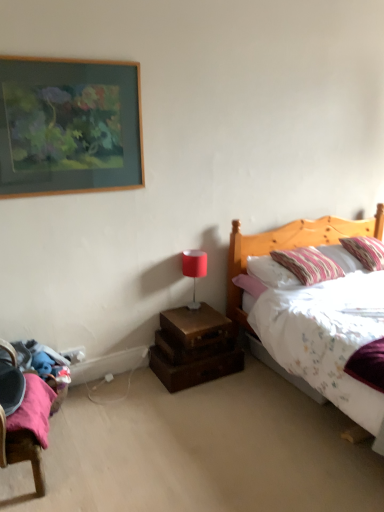
What are the coordinates of `vacant space situated above wooden trunk at lower center (from a real-world perspective)` in the screenshot? It's located at (189, 317).